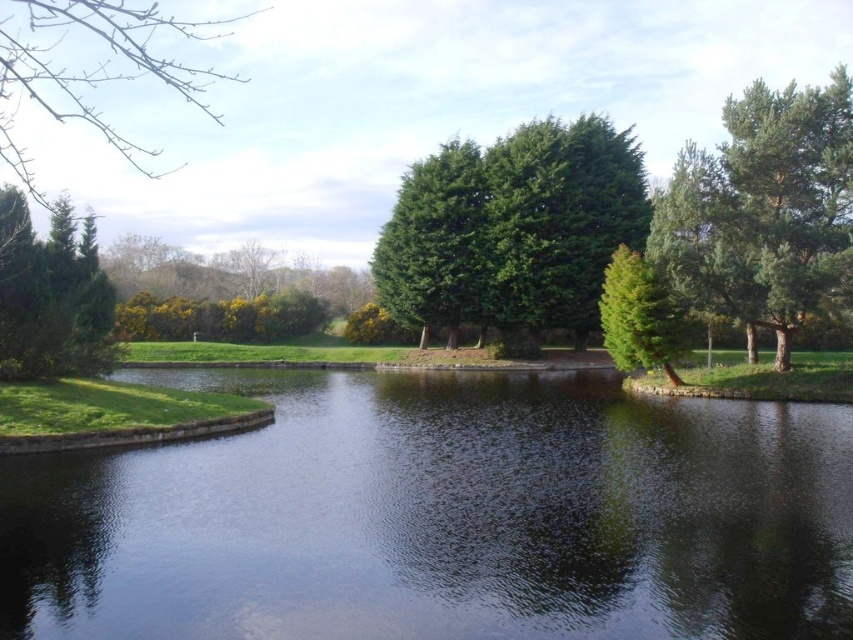
You are standing at the edge of the water and want to determine which tree is shorter between the green matte tree at upper left and the green matte tree at center. Based on the scene, which one should you identify as the shorter one?

The green matte tree at upper left is shorter compared to the green matte tree at center.

You are a hiker standing at the center of the image. You see a point marked at coordinates (x=51, y=296). Based on the scene, where is this point located?

The point is on the green matte tree at upper left.